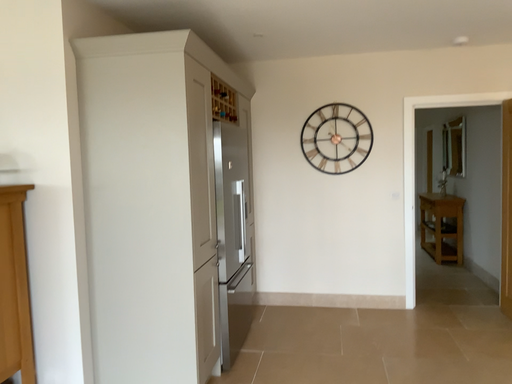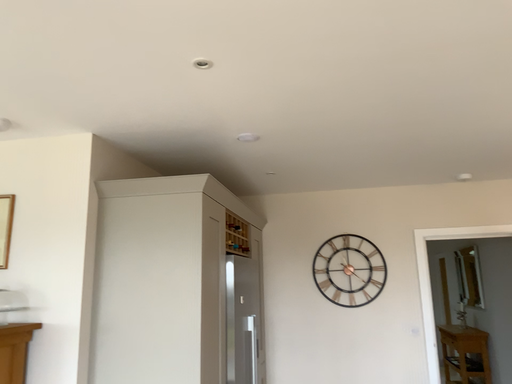
Question: Which way did the camera rotate in the video?

Choices:
 (A) rotated upward
 (B) rotated downward

Answer: (A)